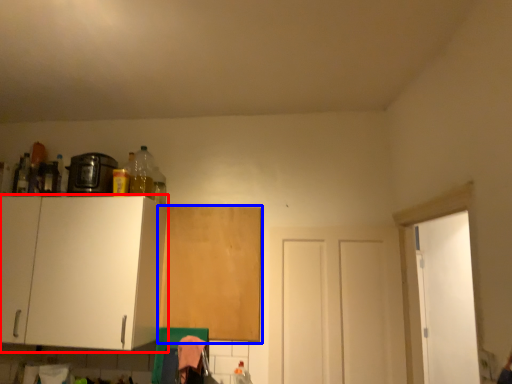
Question: Which point is further to the camera, cabinetry (highlighted by a red box) or cabinetry (highlighted by a blue box)?

Choices:
 (A) cabinetry
 (B) cabinetry

Answer: (B)